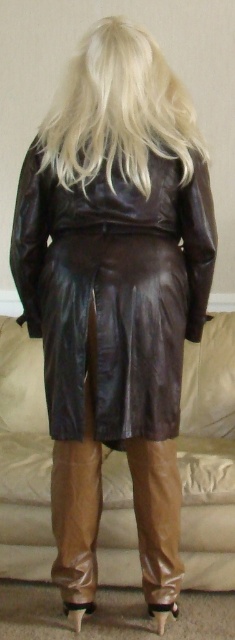
Question: Among these objects, which one is nearest to the camera?

Choices:
 (A) brown leather couch at lower center
 (B) blondehair at upper center

Answer: (B)

Question: Which point is farther to the camera?

Choices:
 (A) brown leather couch at lower center
 (B) blondehair at upper center
 (C) brown leather jacket at center

Answer: (A)

Question: Can you confirm if brown leather couch at lower center is positioned to the left of blondehair at upper center?

Choices:
 (A) no
 (B) yes

Answer: (B)

Question: Is brown leather jacket at center above blondehair at upper center?

Choices:
 (A) no
 (B) yes

Answer: (A)

Question: Estimate the real-world distances between objects in this image. Which object is closer to the blondehair at upper center?

Choices:
 (A) brown leather jacket at center
 (B) brown leather couch at lower center

Answer: (A)

Question: Can you confirm if brown leather jacket at center is positioned to the left of blondehair at upper center?

Choices:
 (A) yes
 (B) no

Answer: (B)